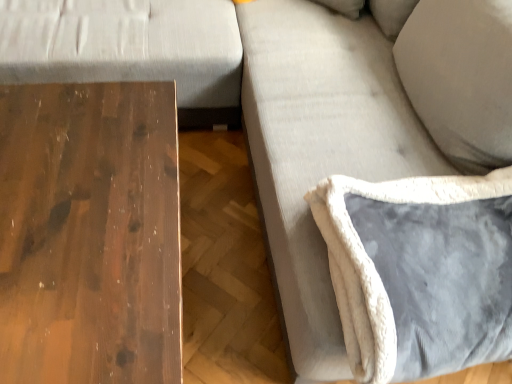
Question: Can you confirm if shiny brown wood table at left is bigger than velvet gray pillow at lower right?

Choices:
 (A) no
 (B) yes

Answer: (B)

Question: Does shiny brown wood table at left turn towards velvet gray pillow at lower right?

Choices:
 (A) yes
 (B) no

Answer: (B)

Question: Can you confirm if shiny brown wood table at left is taller than velvet gray pillow at lower right?

Choices:
 (A) no
 (B) yes

Answer: (B)

Question: Is shiny brown wood table at left further to camera compared to velvet gray pillow at lower right?

Choices:
 (A) yes
 (B) no

Answer: (B)

Question: Is shiny brown wood table at left to the right of velvet gray pillow at lower right from the viewer's perspective?

Choices:
 (A) no
 (B) yes

Answer: (A)

Question: Is shiny brown wood table at left in contact with velvet gray pillow at lower right?

Choices:
 (A) yes
 (B) no

Answer: (B)

Question: Is velvet gray pillow at lower right placed right next to shiny brown wood table at left?

Choices:
 (A) yes
 (B) no

Answer: (B)

Question: Is velvet gray pillow at lower right further to camera compared to shiny brown wood table at left?

Choices:
 (A) no
 (B) yes

Answer: (B)

Question: Would you consider velvet gray pillow at lower right to be distant from shiny brown wood table at left?

Choices:
 (A) no
 (B) yes

Answer: (A)

Question: Is velvet gray pillow at lower right aimed at shiny brown wood table at left?

Choices:
 (A) no
 (B) yes

Answer: (A)

Question: From the image's perspective, does velvet gray pillow at lower right appear lower than shiny brown wood table at left?

Choices:
 (A) yes
 (B) no

Answer: (B)

Question: From the image's perspective, is velvet gray pillow at lower right above shiny brown wood table at left?

Choices:
 (A) yes
 (B) no

Answer: (A)

Question: Based on their positions, is velvet gray pillow at lower right located to the left or right of shiny brown wood table at left?

Choices:
 (A) left
 (B) right

Answer: (B)